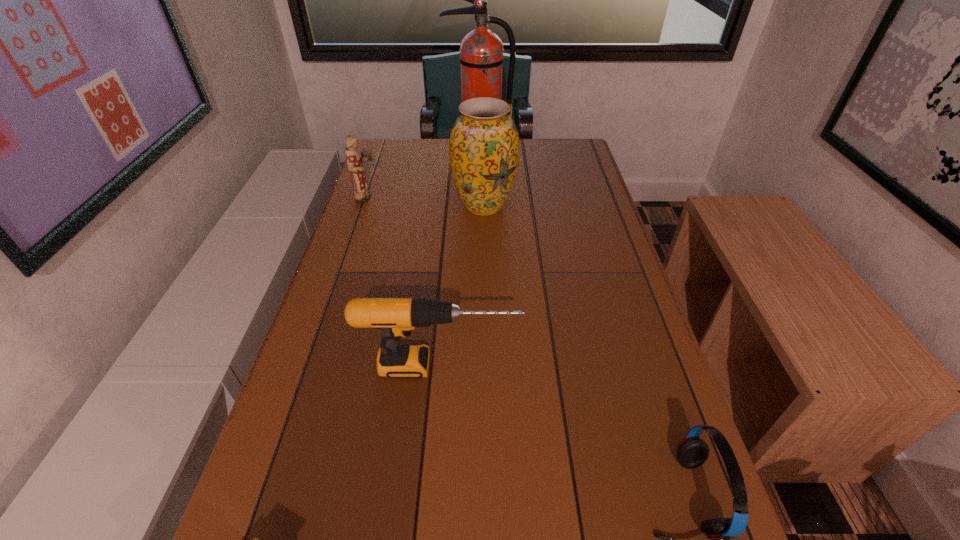
This screenshot has width=960, height=540. In order to click on fire extinguisher in this screenshot , I will do `click(481, 58)`.

Find the location of a particular element. The height and width of the screenshot is (540, 960). the tallest object is located at coordinates (481, 58).

Find the location of a particular element. The width and height of the screenshot is (960, 540). vase is located at coordinates (484, 148).

Find the location of `figurine`. figurine is located at coordinates (361, 195).

The height and width of the screenshot is (540, 960). Identify the location of the fourth farthest object. (396, 317).

At what (x,y) coordinates should I click in order to perform the action: click on vacant space located 0.380m at the nozzle of the fire extinguisher. Please return your answer as a coordinate pair (x, y). Looking at the image, I should click on (479, 226).

I want to click on vacant area located 0.350m on the back of the fifth shortest object, so click(x=483, y=139).

Find the location of a particular element. The height and width of the screenshot is (540, 960). vacant space located on the front-facing side of the figurine is located at coordinates (488, 198).

Locate an element on the screen. The height and width of the screenshot is (540, 960). vacant region located on the handle side of the drill is located at coordinates (591, 366).

Find the location of a particular element. The image size is (960, 540). object that is at the far edge is located at coordinates (481, 58).